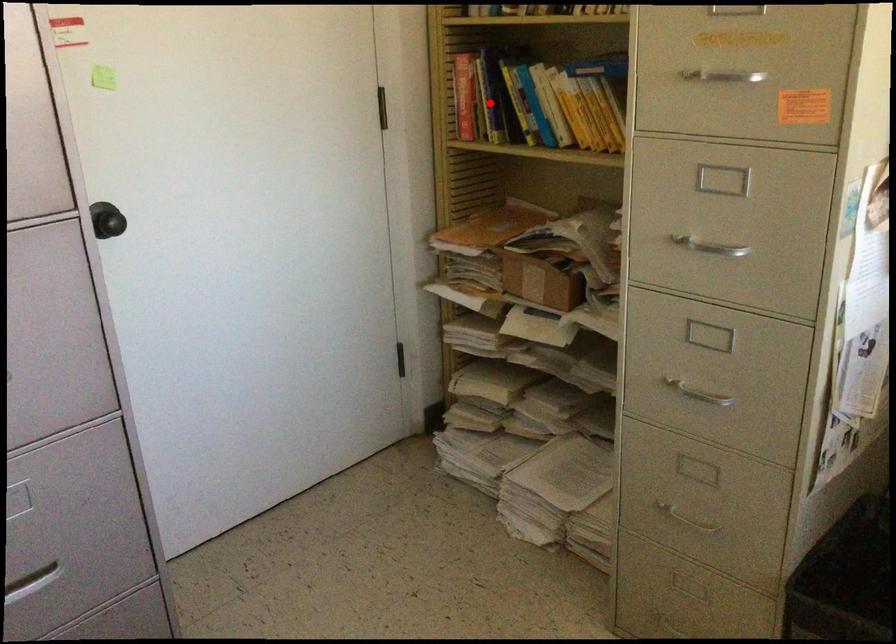
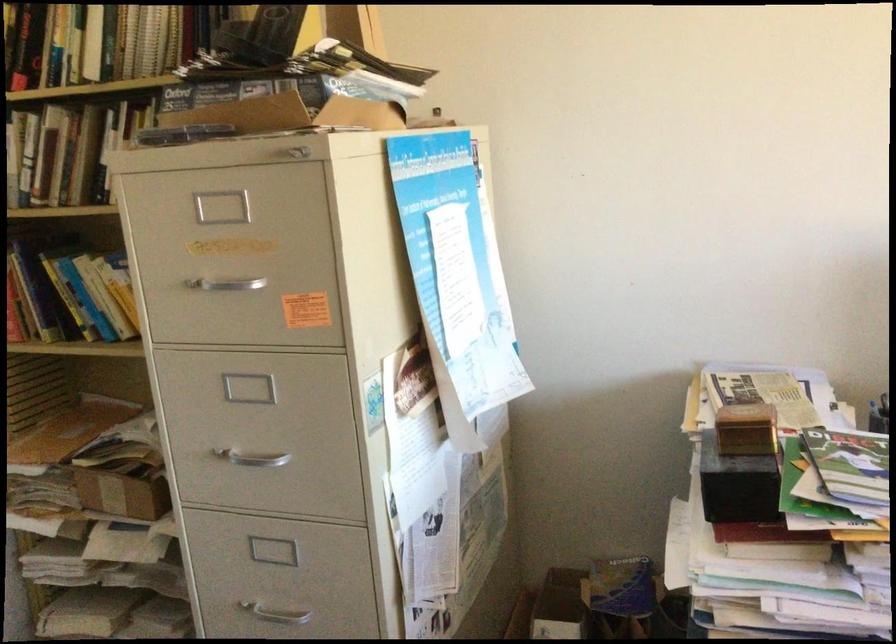
Locate, in the second image, the point that corresponds to the highlighted location in the first image.

(27, 301)